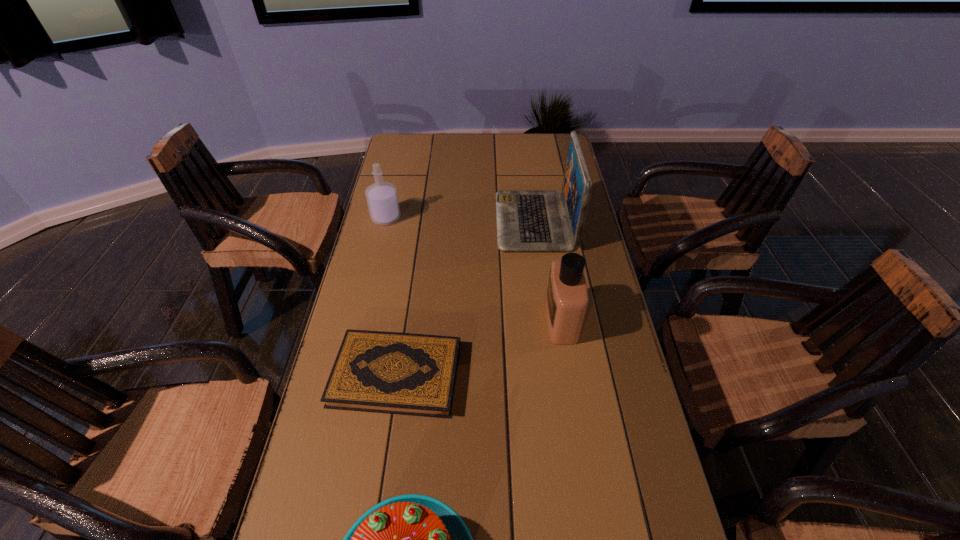
Find the location of a particular element. vacant region at the far right corner is located at coordinates (534, 159).

At what (x,y) coordinates should I click in order to perform the action: click on free spot between the laptop computer and the left perfume. Please return your answer as a coordinate pair (x, y). The image size is (960, 540). Looking at the image, I should click on (460, 220).

Image resolution: width=960 pixels, height=540 pixels. In order to click on vacant point located between the farther perfume and the hardback book in this screenshot , I will do `click(391, 296)`.

Find the location of `empty space that is in between the laptop computer and the left perfume`. empty space that is in between the laptop computer and the left perfume is located at coordinates (460, 220).

You are a GUI agent. You are given a task and a screenshot of the screen. Output one action in this format:
    pyautogui.click(x=<x>, y=<y>)
    Task: Click on the vacant space in between the shortest object and the laptop computer
    
    Given the screenshot: What is the action you would take?
    pyautogui.click(x=466, y=298)

Locate an element on the screen. vacant area that lies between the shortest object and the left perfume is located at coordinates (391, 296).

This screenshot has width=960, height=540. I want to click on vacant space in between the shortest object and the farther perfume, so (x=391, y=296).

Image resolution: width=960 pixels, height=540 pixels. What are the coordinates of `blank region between the left perfume and the shortest object` in the screenshot? It's located at (391, 296).

Locate an element on the screen. The image size is (960, 540). object that is the third nearest to the farther perfume is located at coordinates (566, 303).

The height and width of the screenshot is (540, 960). In order to click on object that is the fourth closest to the farther perfume in this screenshot , I will do `click(412, 539)`.